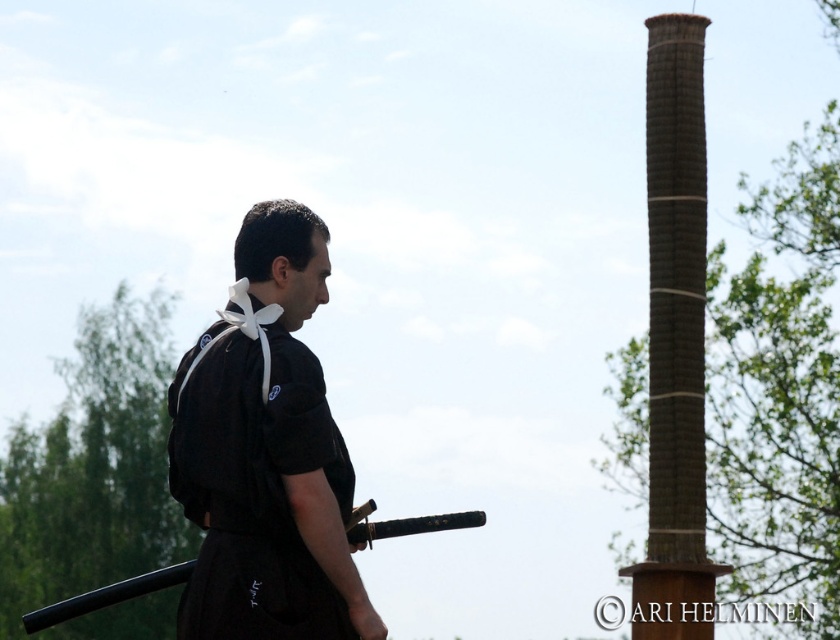
Is black matte kimono at center smaller than brown textured pole at right?

No, black matte kimono at center is not smaller than brown textured pole at right.

In order to click on black matte kimono at center in this screenshot , I will do `click(266, 456)`.

Between point (648, 241) and point (407, 522), which one is positioned in front?

Positioned in front is point (407, 522).

Is point (651, 481) closer to camera compared to point (176, 584)?

No, (651, 481) is behind (176, 584).

What do you see at coordinates (675, 340) in the screenshot? I see `brown textured pole at right` at bounding box center [675, 340].

I want to click on brown textured pole at right, so click(x=675, y=340).

Can you confirm if black matte kimono at center is positioned to the left of black matte sword at center?

In fact, black matte kimono at center is to the right of black matte sword at center.

Which is behind, point (180, 472) or point (134, 592)?

Positioned behind is point (180, 472).

Find the location of a particular element. This screenshot has width=840, height=640. black matte kimono at center is located at coordinates (266, 456).